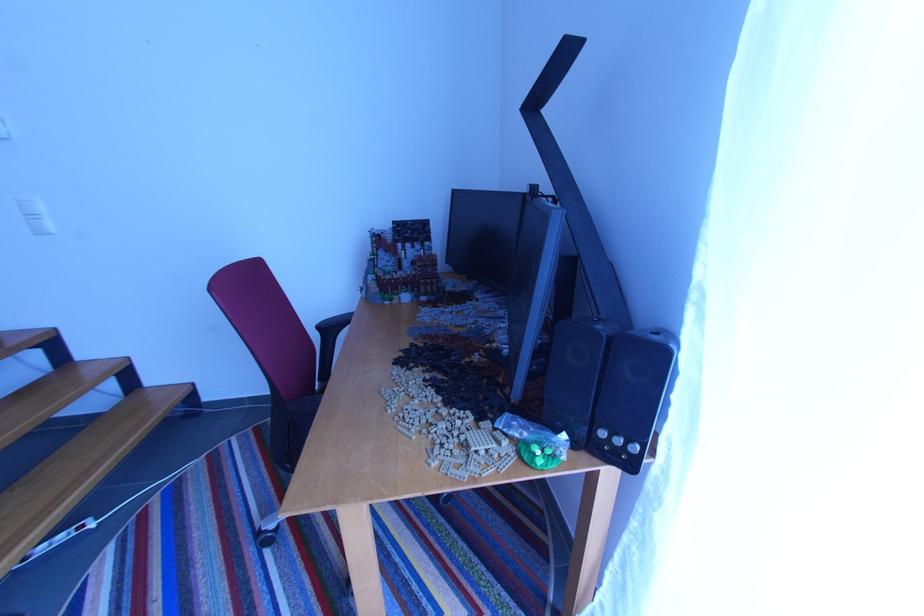
Describe the element at coordinates (619, 447) in the screenshot. The height and width of the screenshot is (616, 924). I see `the silver speaker button` at that location.